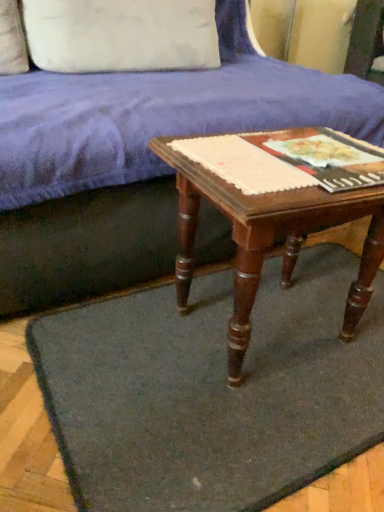
Question: From the image's perspective, is dark gray felt mat at center beneath white cotton pillow at upper left?

Choices:
 (A) yes
 (B) no

Answer: (A)

Question: From a real-world perspective, is dark gray felt mat at center physically above white cotton pillow at upper left?

Choices:
 (A) no
 (B) yes

Answer: (A)

Question: Is dark gray felt mat at center further to camera compared to white cotton pillow at upper left?

Choices:
 (A) yes
 (B) no

Answer: (B)

Question: Can you confirm if dark gray felt mat at center is thinner than white cotton pillow at upper left?

Choices:
 (A) yes
 (B) no

Answer: (B)

Question: Are dark gray felt mat at center and white cotton pillow at upper left making contact?

Choices:
 (A) yes
 (B) no

Answer: (B)

Question: Can you confirm if dark gray felt mat at center is positioned to the right of white cotton pillow at upper left?

Choices:
 (A) no
 (B) yes

Answer: (B)

Question: Considering the relative positions of matte paper at center, the first paperback book when ordered from right to left, and wooden table at center in the image provided, is matte paper at center, the first paperback book when ordered from right to left, to the left of wooden table at center from the viewer's perspective?

Choices:
 (A) yes
 (B) no

Answer: (B)

Question: From a real-world perspective, is matte paper at center, the first paperback book when ordered from right to left, positioned under wooden table at center based on gravity?

Choices:
 (A) no
 (B) yes

Answer: (A)

Question: Would you say matte paper at center, the first paperback book when ordered from right to left, contains wooden table at center?

Choices:
 (A) yes
 (B) no

Answer: (B)

Question: Is the position of matte paper at center, the first paperback book when ordered from right to left, more distant than that of wooden table at center?

Choices:
 (A) yes
 (B) no

Answer: (A)

Question: Is matte paper at center, the 2th paperback book positioned from the left, outside of wooden table at center?

Choices:
 (A) yes
 (B) no

Answer: (B)

Question: Is matte paper at center, the 2th paperback book positioned from the left, facing towards wooden table at center?

Choices:
 (A) no
 (B) yes

Answer: (B)

Question: Is white cotton pillow at upper left turned away from velvet blue couch at upper center?

Choices:
 (A) yes
 (B) no

Answer: (A)